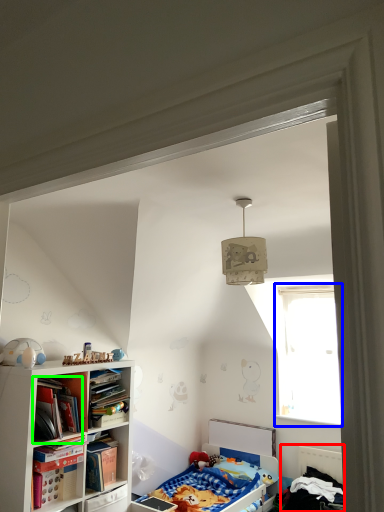
Question: Which object is positioned farthest from bed (highlighted by a red box)? Select from window (highlighted by a blue box) and book (highlighted by a green box).

Choices:
 (A) window
 (B) book

Answer: (B)